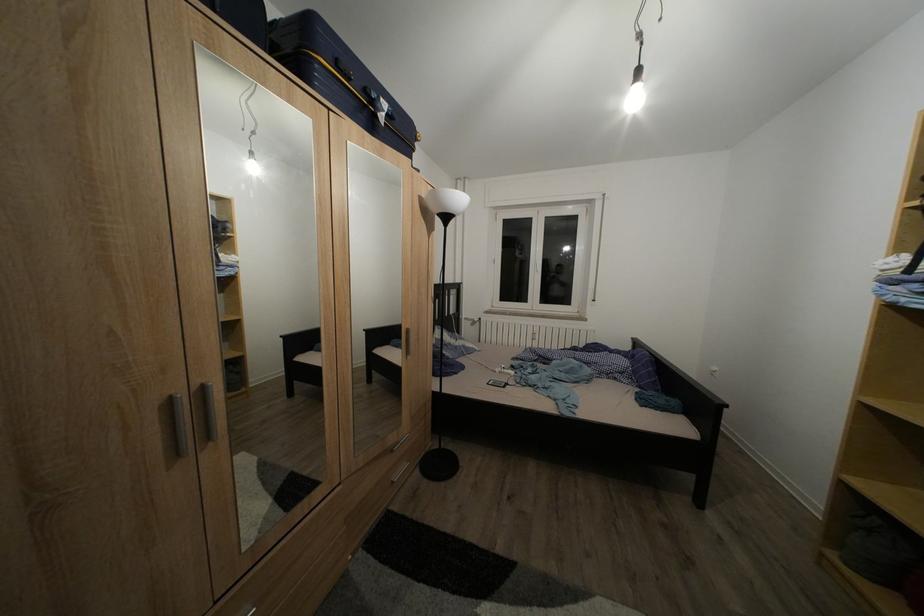
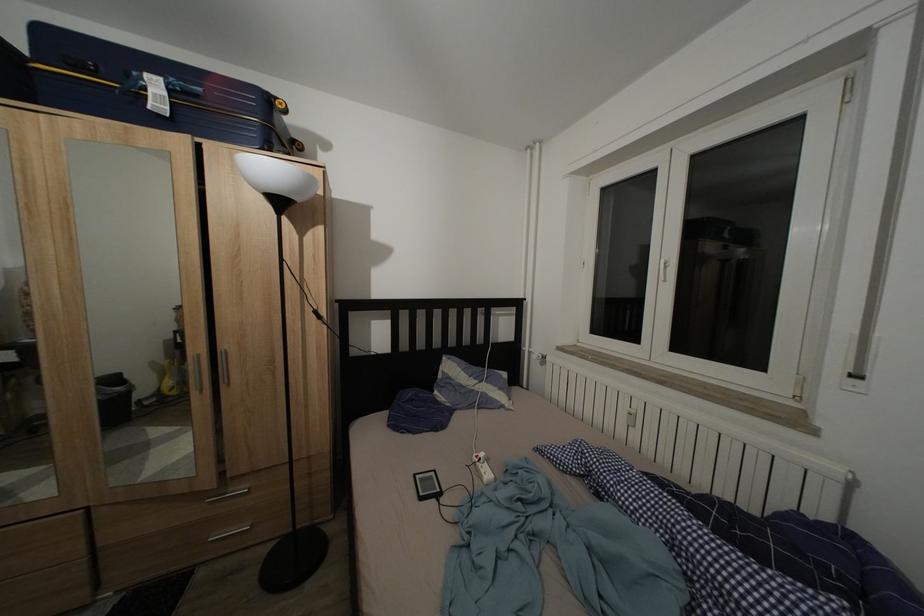
In the second image, find the point that corresponds to pixel 517 379 in the first image.

(488, 483)